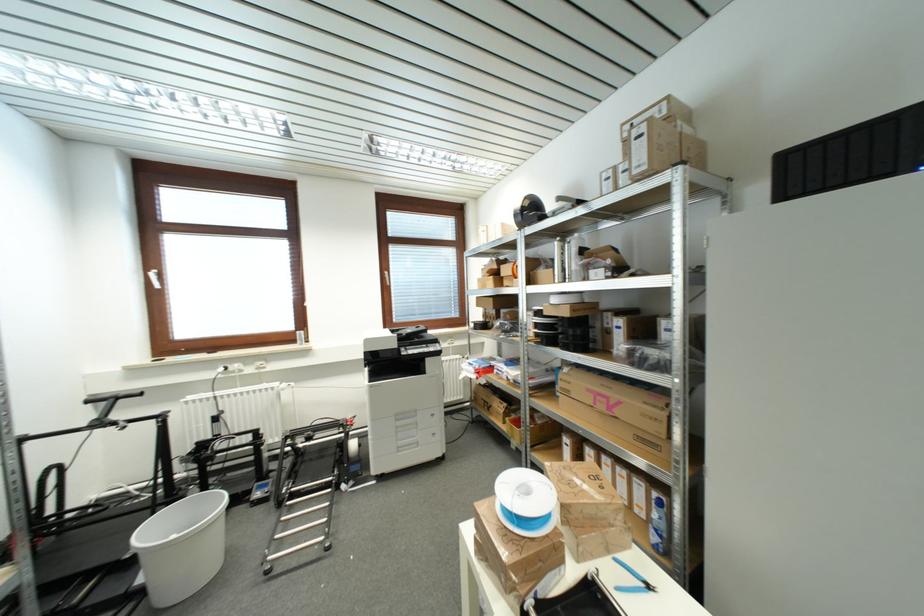
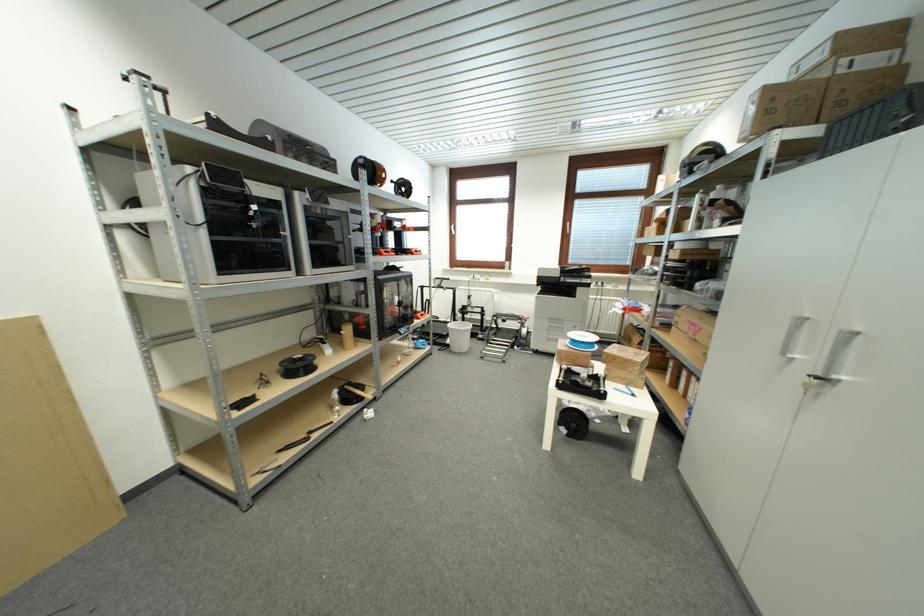
Where in the second image is the point corresponding to (144,582) from the first image?

(453, 344)